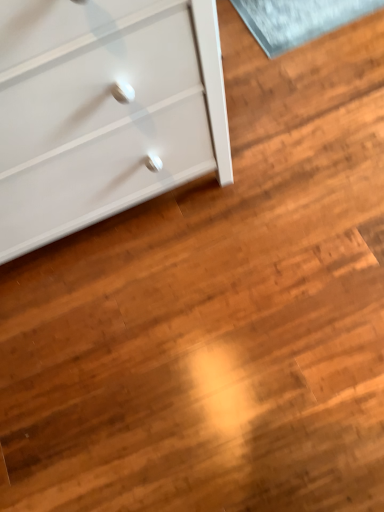
Where is `white glossy chest of drawers at upper left`? The image size is (384, 512). white glossy chest of drawers at upper left is located at coordinates (104, 111).

Describe the element at coordinates (104, 111) in the screenshot. This screenshot has height=512, width=384. I see `white glossy chest of drawers at upper left` at that location.

Locate an element on the screen. The image size is (384, 512). white glossy chest of drawers at upper left is located at coordinates (104, 111).